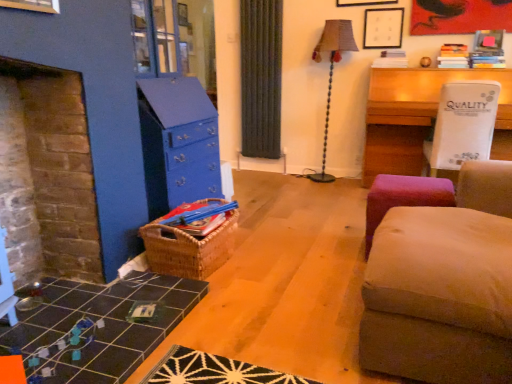
Question: Is velvet beige ottoman at right smaller than black tile table at lower left, which appears as the first table when viewed from the front?

Choices:
 (A) no
 (B) yes

Answer: (A)

Question: Can you confirm if velvet beige ottoman at right is shorter than black tile table at lower left, positioned as the 1th table in bottom-to-top order?

Choices:
 (A) yes
 (B) no

Answer: (B)

Question: From the image's perspective, is velvet beige ottoman at right under black tile table at lower left, the second table viewed from the back?

Choices:
 (A) yes
 (B) no

Answer: (B)

Question: Could you tell me if velvet beige ottoman at right is facing black tile table at lower left, the second table viewed from the back?

Choices:
 (A) no
 (B) yes

Answer: (B)

Question: Are velvet beige ottoman at right and black tile table at lower left, the second table viewed from the back, located far from each other?

Choices:
 (A) no
 (B) yes

Answer: (B)

Question: Considering the relative positions of woven brown basket at center and textured beige lampshade at center-right in the image provided, is woven brown basket at center to the left or to the right of textured beige lampshade at center-right?

Choices:
 (A) right
 (B) left

Answer: (B)

Question: Considering the positions of point (159, 266) and point (328, 117), is point (159, 266) closer or farther from the camera than point (328, 117)?

Choices:
 (A) farther
 (B) closer

Answer: (B)

Question: In terms of height, does woven brown basket at center look taller or shorter compared to textured beige lampshade at center-right?

Choices:
 (A) short
 (B) tall

Answer: (A)

Question: In terms of width, does woven brown basket at center look wider or thinner when compared to textured beige lampshade at center-right?

Choices:
 (A) thin
 (B) wide

Answer: (B)

Question: From the image's perspective, is white plastic table at upper right, positioned as the second table in front-to-back order, above or below woven brown basket at center?

Choices:
 (A) above
 (B) below

Answer: (A)

Question: Is point (397, 140) closer or farther from the camera than point (164, 241)?

Choices:
 (A) closer
 (B) farther

Answer: (B)

Question: From a real-world perspective, is white plastic table at upper right, which ranks as the 2th table in left-to-right order, above or below woven brown basket at center?

Choices:
 (A) above
 (B) below

Answer: (A)

Question: Considering the positions of white plastic table at upper right, which ranks as the 2th table in left-to-right order, and woven brown basket at center in the image, is white plastic table at upper right, which ranks as the 2th table in left-to-right order, bigger or smaller than woven brown basket at center?

Choices:
 (A) big
 (B) small

Answer: (A)

Question: From a real-world perspective, is woven brown basket at center physically located above or below white plastic table at upper right, marked as the second table in a bottom-to-top arrangement?

Choices:
 (A) above
 (B) below

Answer: (B)

Question: Considering their positions, is woven brown basket at center located in front of or behind white plastic table at upper right, positioned as the second table in front-to-back order?

Choices:
 (A) front
 (B) behind

Answer: (A)